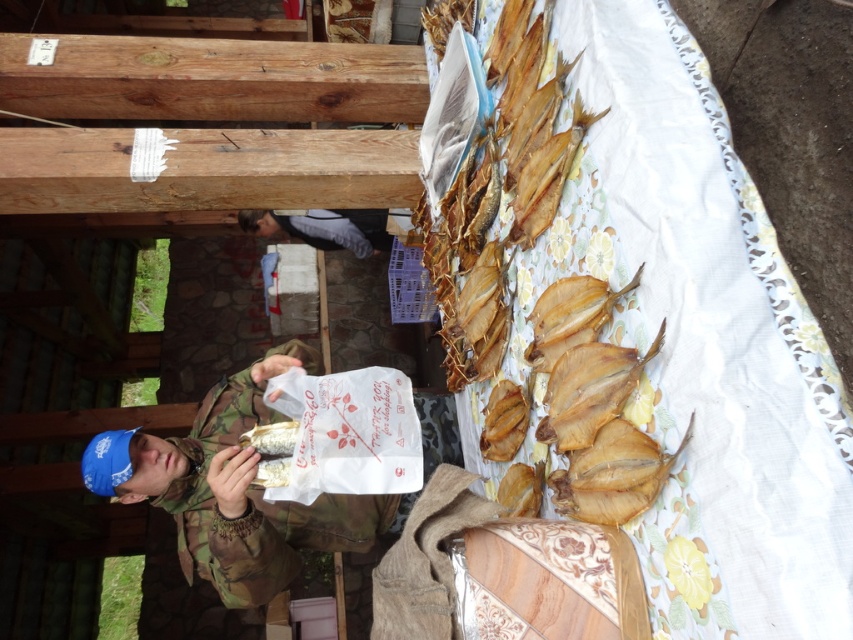
Is brown crispy fish at upper right thinner than gray fabric at center?

Yes.

Between brown crispy fish at upper right and gray fabric at center, which one has more height?

With more height is brown crispy fish at upper right.

What do you see at coordinates (500, 193) in the screenshot? This screenshot has height=640, width=853. I see `brown crispy fish at upper right` at bounding box center [500, 193].

The height and width of the screenshot is (640, 853). Identify the location of brown crispy fish at upper right. (500, 193).

Where is `brown crispy fish at upper right`? brown crispy fish at upper right is located at coordinates (500, 193).

Is camouflage jacket at center shorter than gray fabric at center?

No.

Does camouflage jacket at center lie behind gray fabric at center?

No, it is not.

Identify the location of camouflage jacket at center. The height and width of the screenshot is (640, 853). (233, 490).